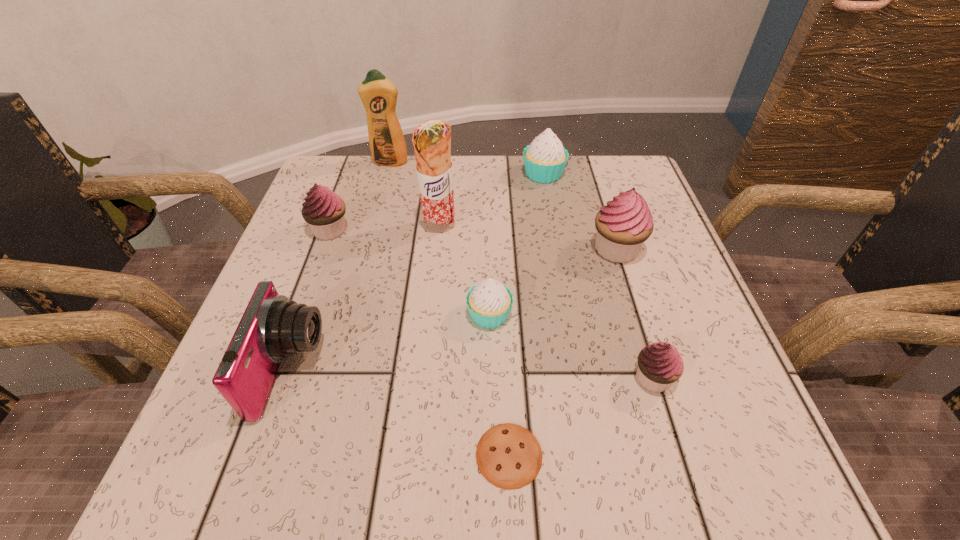
Where is `vacant area situated on the back of the nearest cupcake`? vacant area situated on the back of the nearest cupcake is located at coordinates (617, 261).

This screenshot has height=540, width=960. In order to click on free region located 0.220m on the left of the smaller white cupcake in this screenshot , I will do `click(342, 314)`.

This screenshot has width=960, height=540. I want to click on free space located on the back of the shortest object, so click(x=502, y=312).

Image resolution: width=960 pixels, height=540 pixels. What are the coordinates of `detergent at the far edge` in the screenshot? It's located at (378, 94).

This screenshot has height=540, width=960. I want to click on cupcake present at the far edge, so click(545, 158).

At what (x,y) coordinates should I click in order to perform the action: click on camera at the near edge. Please return your answer as a coordinate pair (x, y). The image size is (960, 540). Looking at the image, I should click on (272, 327).

You are a GUI agent. You are given a task and a screenshot of the screen. Output one action in this format:
    pyautogui.click(x=<x>, y=<y>)
    Task: Click on the cookie that is at the near edge
    This screenshot has width=960, height=540.
    Given the screenshot: What is the action you would take?
    pyautogui.click(x=509, y=456)

The height and width of the screenshot is (540, 960). I want to click on detergent located at the left edge, so click(378, 94).

Identify the location of cupcake that is at the left edge. The height and width of the screenshot is (540, 960). (323, 210).

The width and height of the screenshot is (960, 540). What are the coordinates of `camera that is at the left edge` in the screenshot? It's located at (272, 327).